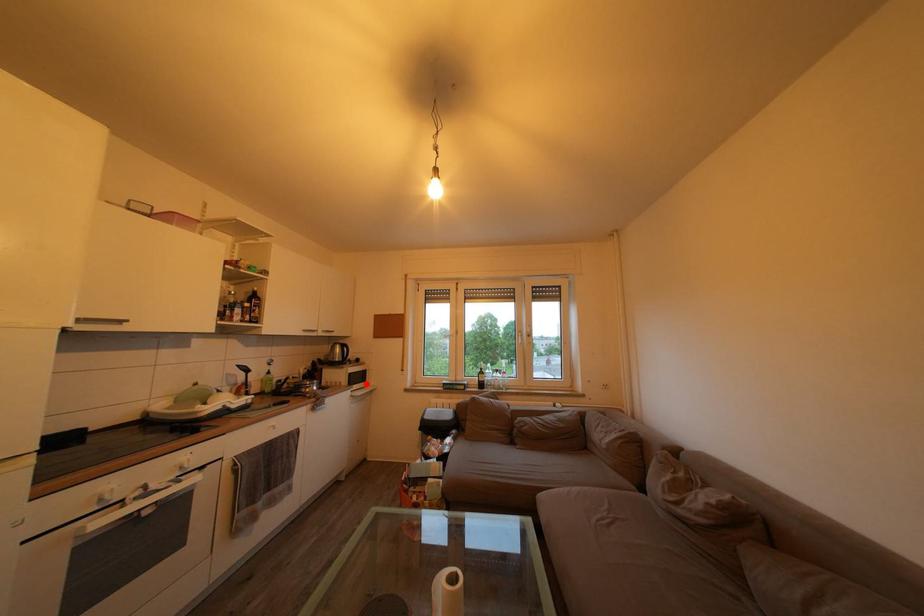
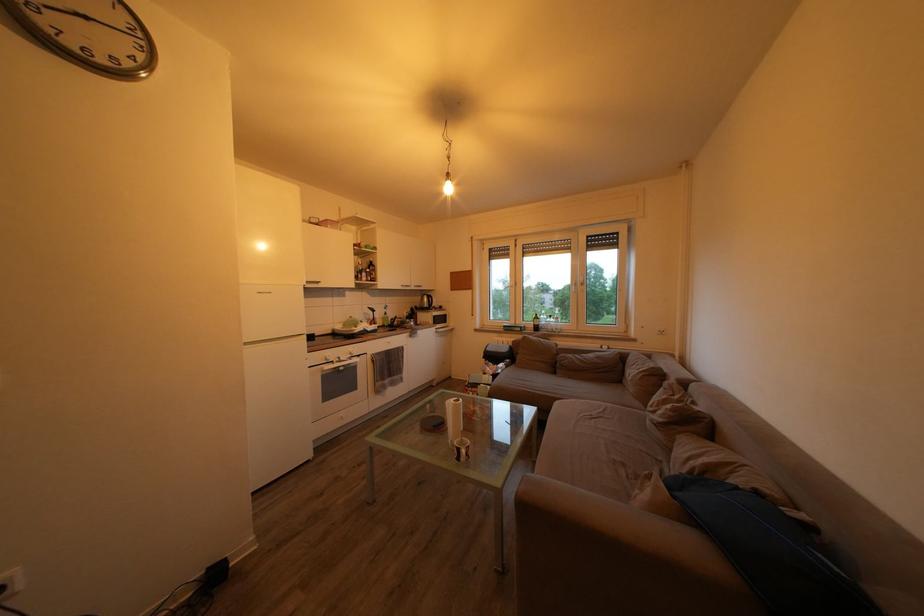
Question: A red point is marked in image1. In image2, is the corresponding 3D point closer to the camera or farther? Reply with the corresponding letter.

Choices:
 (A) The corresponding 3D point is closer.
 (B) The corresponding 3D point is farther.

Answer: (A)